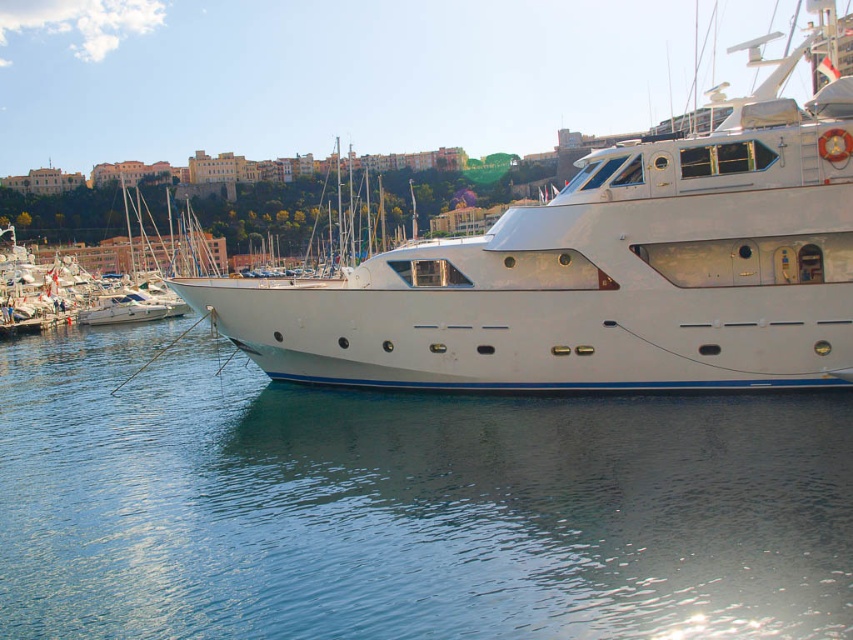
Question: Does clear blue water at lower center appear under white glossy yacht at center?

Choices:
 (A) yes
 (B) no

Answer: (A)

Question: Can you confirm if clear blue water at lower center is positioned to the left of white glossy yacht at center?

Choices:
 (A) yes
 (B) no

Answer: (A)

Question: Which of the following is the farthest from the observer?

Choices:
 (A) (724, 609)
 (B) (784, 228)

Answer: (B)

Question: Which of the following is the closest to the observer?

Choices:
 (A) white glossy yacht at center
 (B) clear blue water at lower center

Answer: (B)

Question: In this image, where is clear blue water at lower center located relative to white glossy yacht at center?

Choices:
 (A) left
 (B) right

Answer: (A)